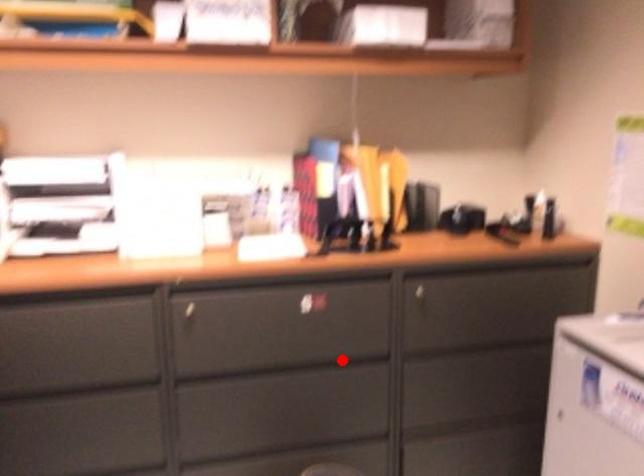
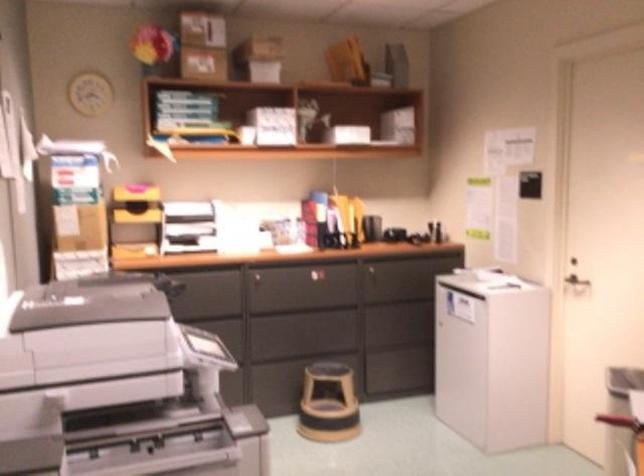
Question: A red point is marked in image1. In image2, is the corresponding 3D point closer to the camera or farther? Reply with the corresponding letter.

Choices:
 (A) The corresponding 3D point is closer.
 (B) The corresponding 3D point is farther.

Answer: (B)